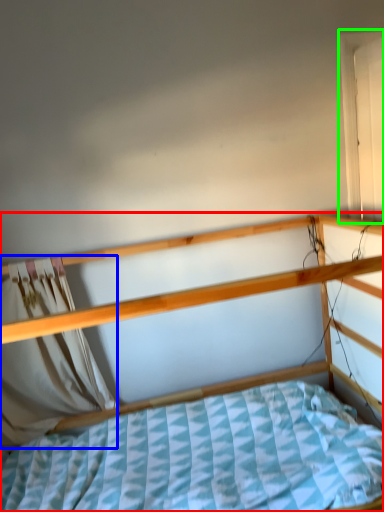
Question: Which object is positioned closest to bed (highlighted by a red box)? Select from curtain (highlighted by a blue box) and window (highlighted by a green box).

Choices:
 (A) curtain
 (B) window

Answer: (A)